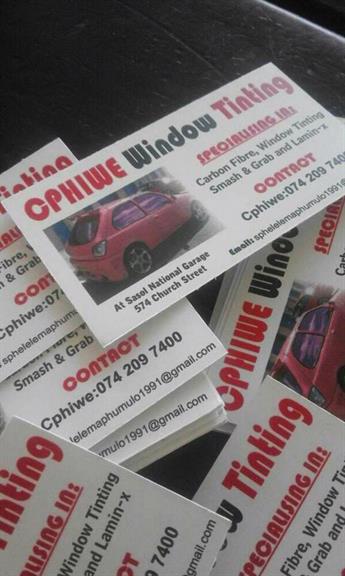
The height and width of the screenshot is (576, 345). Identify the location of black table top. (80, 103), (185, 457), (203, 303), (328, 71), (61, 22).